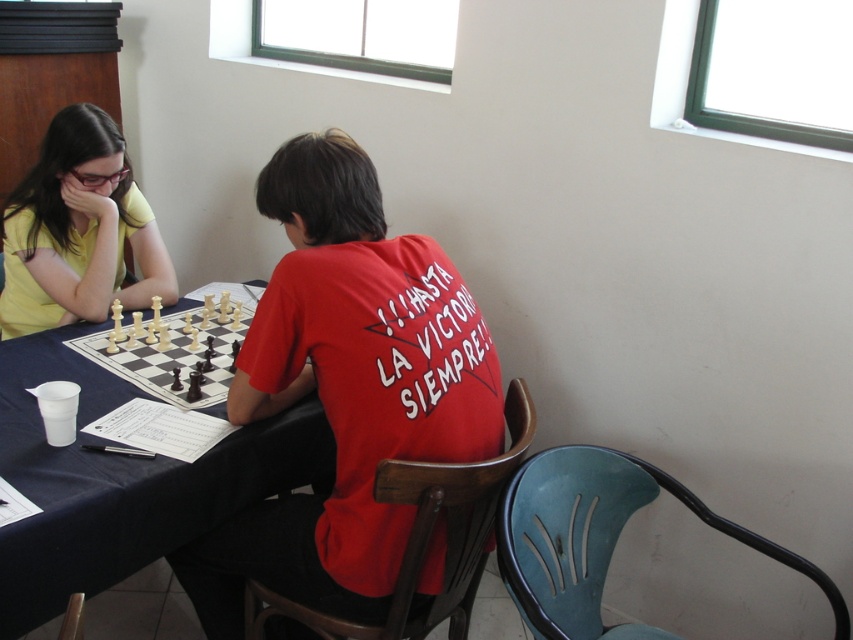
Can you confirm if red matte shirt at center is positioned to the left of white plastic chess set at center?

In fact, red matte shirt at center is to the right of white plastic chess set at center.

Who is higher up, red matte shirt at center or white plastic chess set at center?

Positioned higher is white plastic chess set at center.

At what (x,y) coordinates should I click in order to perform the action: click on red matte shirt at center. Please return your answer as a coordinate pair (x, y). Looking at the image, I should click on [345, 388].

Between point (405, 538) and point (111, 216), which one is positioned behind?

Point (111, 216)

Who is positioned more to the right, red matte shirt at center or matte yellow shirt at left?

Positioned to the right is red matte shirt at center.

Is point (398, 442) closer to camera compared to point (91, 152)?

Yes, it is.

The image size is (853, 640). Identify the location of red matte shirt at center. (345, 388).

From the picture: Measure the distance between matte yellow shirt at left and camera.

matte yellow shirt at left is 6.32 feet away from camera.

The height and width of the screenshot is (640, 853). Identify the location of matte yellow shirt at left. (78, 230).

What do you see at coordinates (78, 230) in the screenshot? I see `matte yellow shirt at left` at bounding box center [78, 230].

This screenshot has width=853, height=640. In order to click on matte yellow shirt at left in this screenshot , I will do `click(78, 230)`.